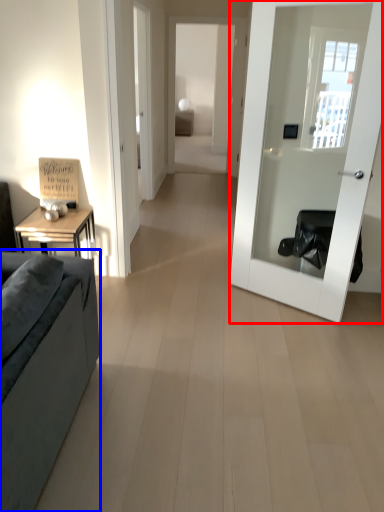
Question: Which object is closer to the camera taking this photo, door (highlighted by a red box) or studio couch (highlighted by a blue box)?

Choices:
 (A) door
 (B) studio couch

Answer: (B)